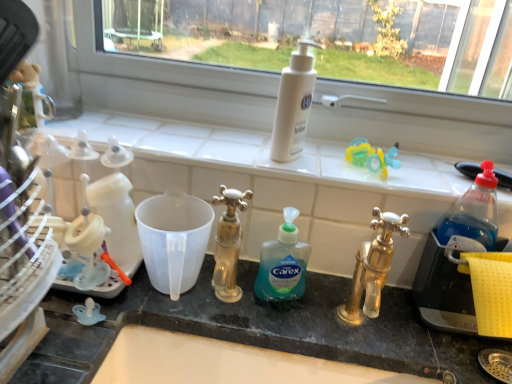
Question: Looking at their shapes, would you say white matte lotion at upper center, which is the second cleaning product in bottom-to-top order, is wider or thinner than green translucent liquid soap at center, the second cleaning product viewed from the top?

Choices:
 (A) wide
 (B) thin

Answer: (A)

Question: Based on their positions, is white matte lotion at upper center, which is the second cleaning product in bottom-to-top order, located to the left or right of green translucent liquid soap at center, the second cleaning product viewed from the top?

Choices:
 (A) right
 (B) left

Answer: (A)

Question: Is point tap(295, 135) closer or farther from the camera than point tap(263, 279)?

Choices:
 (A) closer
 (B) farther

Answer: (B)

Question: Based on their sizes in the image, would you say green translucent liquid soap at center, the 1th cleaning product from the bottom, is bigger or smaller than white matte lotion at upper center, the first cleaning product from the top?

Choices:
 (A) big
 (B) small

Answer: (B)

Question: In the image, is green translucent liquid soap at center, the second cleaning product viewed from the top, on the left side or the right side of white matte lotion at upper center, the first cleaning product from the top?

Choices:
 (A) right
 (B) left

Answer: (B)

Question: Considering the positions of green translucent liquid soap at center, the second cleaning product viewed from the top, and white matte lotion at upper center, which is the second cleaning product in bottom-to-top order, in the image, is green translucent liquid soap at center, the second cleaning product viewed from the top, wider or thinner than white matte lotion at upper center, which is the second cleaning product in bottom-to-top order,?

Choices:
 (A) wide
 (B) thin

Answer: (B)

Question: In terms of height, does green translucent liquid soap at center, the second cleaning product viewed from the top, look taller or shorter compared to white matte lotion at upper center, the first cleaning product from the top?

Choices:
 (A) short
 (B) tall

Answer: (A)